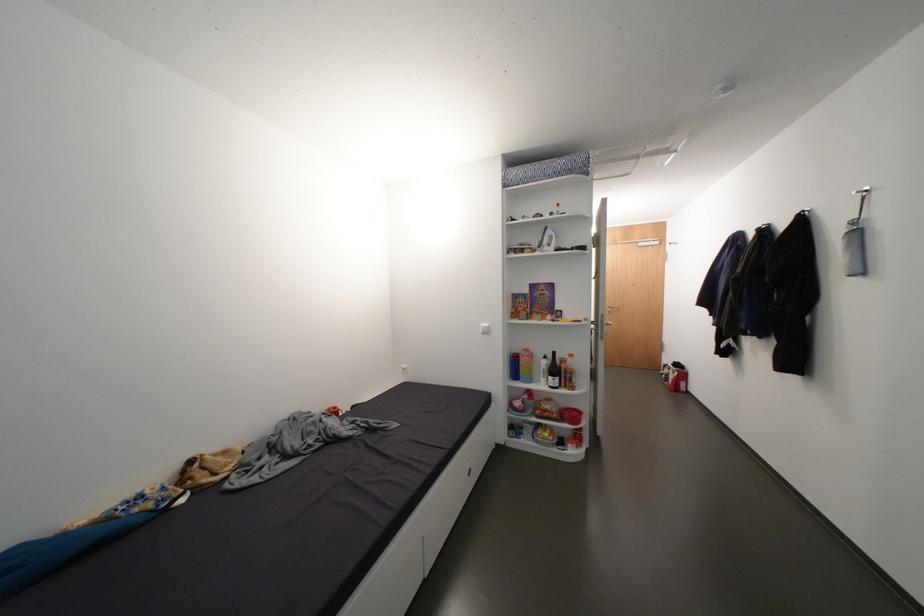
What do you see at coordinates (614, 320) in the screenshot?
I see `the metal door handle` at bounding box center [614, 320].